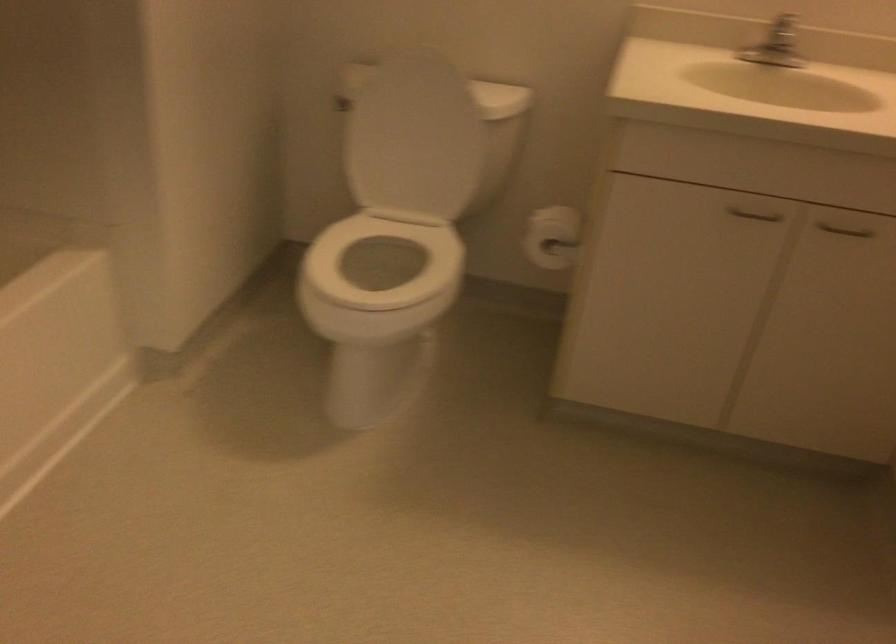
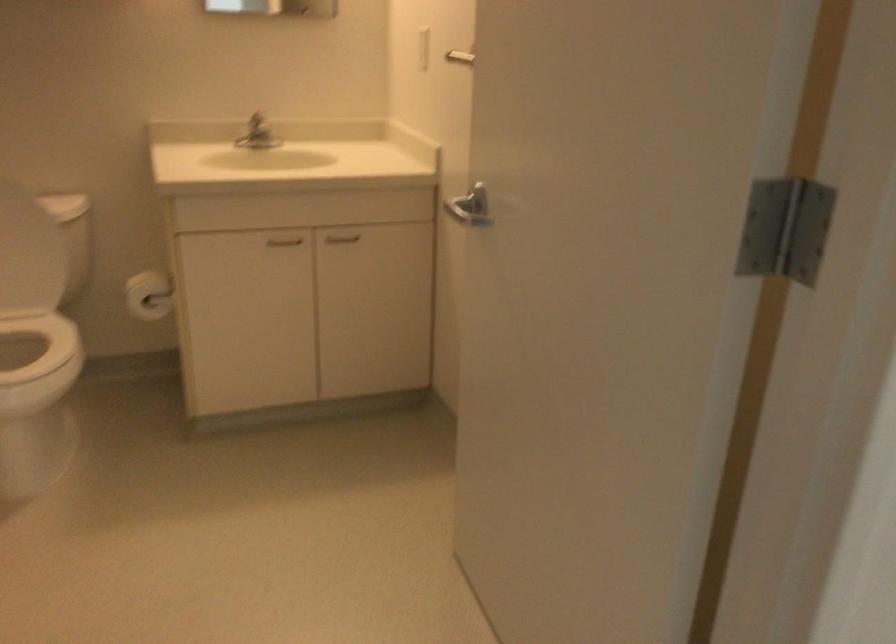
The point at (554, 245) is marked in the first image. Where is the corresponding point in the second image?

(149, 295)